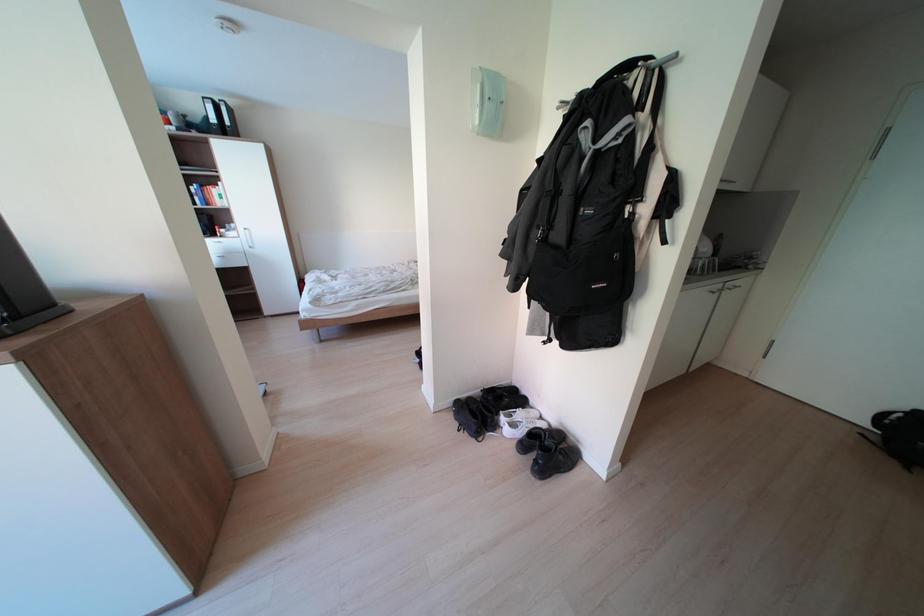
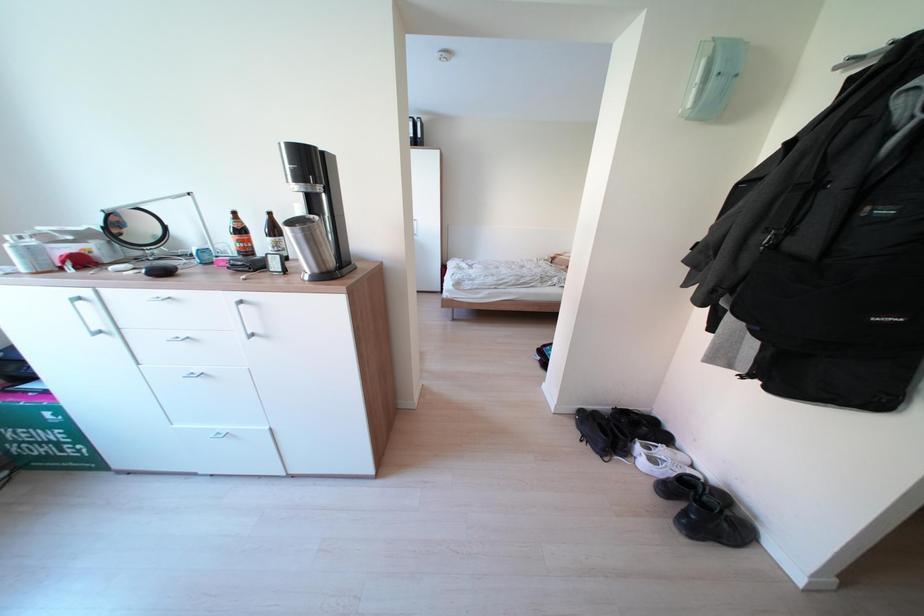
The images are taken continuously from a first-person perspective. In which direction are you moving?

The movement direction of the cameraman is left, backward.